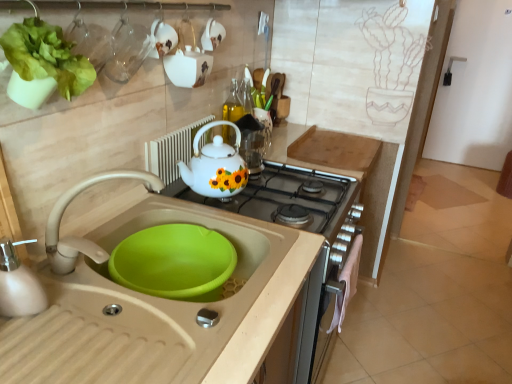
Question: Looking at their shapes, would you say transparent glass cup at upper left is wider or thinner than white ceramic teapot at upper center, placed as the 1th appliance when sorted from bottom to top?

Choices:
 (A) wide
 (B) thin

Answer: (A)

Question: Relative to white ceramic teapot at upper center, placed as the 1th appliance when sorted from bottom to top, is transparent glass cup at upper left in front or behind?

Choices:
 (A) front
 (B) behind

Answer: (A)

Question: Which object is positioned closest to the white glossy teapot at upper center, the first appliance when ordered from top to bottom?

Choices:
 (A) matte beige faucet at sink left
 (B) beige plastic sink at lower left
 (C) white glossy teapot at center
 (D) transparent glass cup at upper left
 (E) white glossy gas stove at center

Answer: (D)

Question: Estimate the real-world distances between objects in this image. Which object is closer to the beige tile at lower right?

Choices:
 (A) transparent glass cup at upper left
 (B) matte beige faucet at sink left
 (C) white glossy teapot at center
 (D) white ceramic teapot at upper center, the second appliance from the top
 (E) white glossy gas stove at center

Answer: (E)